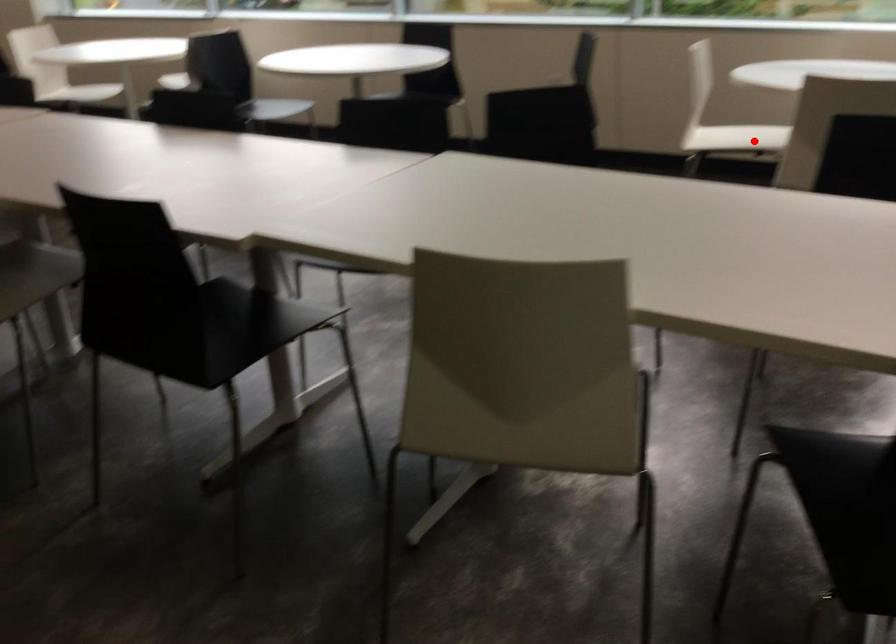
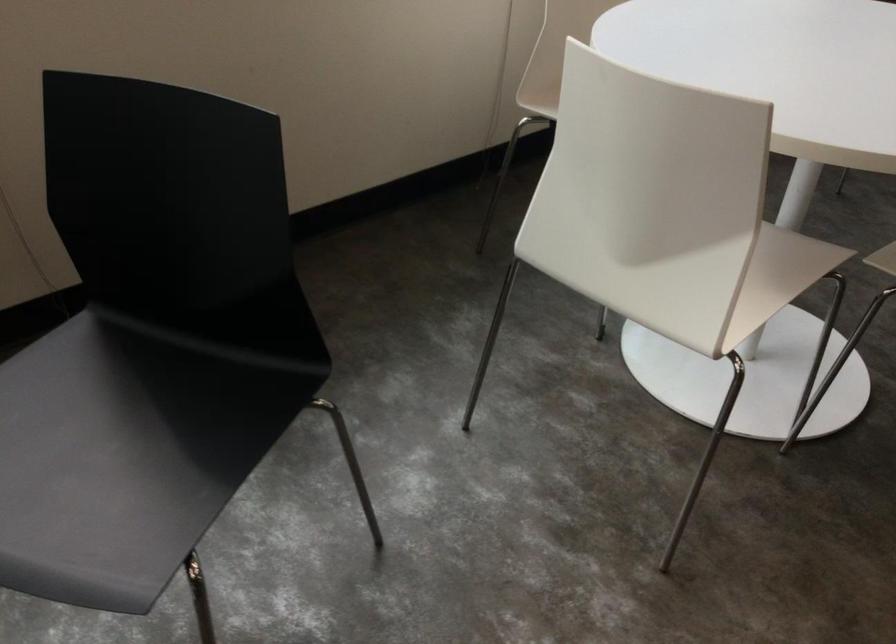
Question: I am providing you with two images of the same scene from different viewpoints. In image1, a red point is highlighted. Considering the same 3D point in image2, which of the following is correct?

Choices:
 (A) It is closer
 (B) It is farther

Answer: (A)